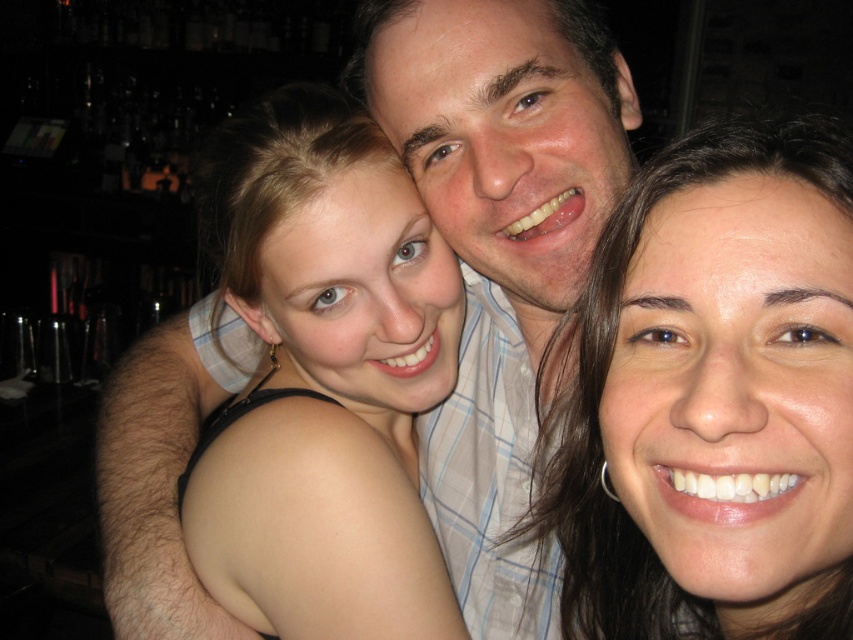
Question: Which object appears farthest from the camera in this image?

Choices:
 (A) smooth skin face at center
 (B) white plaid shirt at center

Answer: (B)

Question: Does smooth skin face at center appear over white plaid shirt at center?

Choices:
 (A) yes
 (B) no

Answer: (B)

Question: Observing the image, what is the correct spatial positioning of smooth skin face at center in reference to white plaid shirt at center?

Choices:
 (A) left
 (B) right

Answer: (B)

Question: Can you confirm if smooth skin face at center is thinner than white plaid shirt at center?

Choices:
 (A) yes
 (B) no

Answer: (A)

Question: Which of the following is the farthest from the observer?

Choices:
 (A) white plaid shirt at center
 (B) smooth skin face at center

Answer: (A)

Question: Which of the following is the farthest from the observer?

Choices:
 (A) white plaid shirt at center
 (B) smooth skin shoulder at center

Answer: (B)